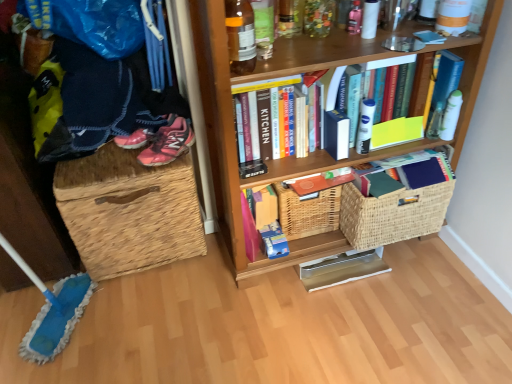
Question: Is point (426, 61) closer or farther from the camera than point (181, 152)?

Choices:
 (A) closer
 (B) farther

Answer: (A)

Question: Is hardcover books at upper center, which ranks as the third book in bottom-to-top order, inside the boundaries of pink mesh sneakers at left, or outside?

Choices:
 (A) inside
 (B) outside

Answer: (B)

Question: Which object is the farthest from the woven wicker basket at right, positioned as the 1th basket in right-to-left order?

Choices:
 (A) metallic gold book at lower center, positioned as the third book in top-to-bottom order
 (B) hardcover books at upper center, which ranks as the third book in bottom-to-top order
 (C) woven straw laundry basket at left
 (D) woven brown basket at center, arranged as the 1th basket when viewed from the left
 (E) translucent glass bottle at upper center

Answer: (C)

Question: Which of these objects is positioned closest to the wooden bookcase at right?

Choices:
 (A) hardcover books at upper center, which ranks as the third book in bottom-to-top order
 (B) woven straw laundry basket at left
 (C) woven wicker basket at right, marked as the second basket in a left-to-right arrangement
 (D) metallic gold book at lower center, the first book from the bottom
 (E) pink mesh sneakers at left

Answer: (A)